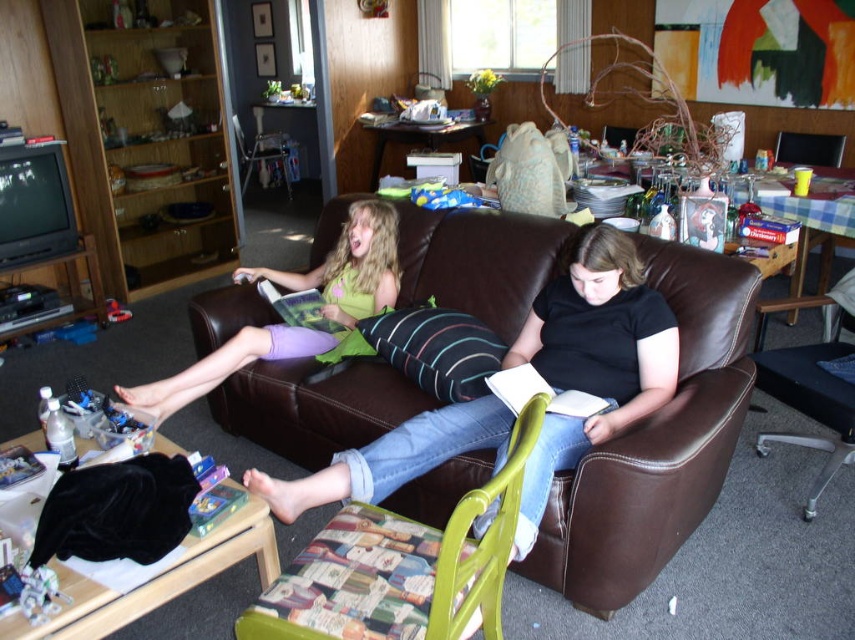
From the picture: You are standing in the living room and want to place a small plant between the two points, point (432, 401) and point (771, 372). Which point should the plant be closer to in order to be closer to the viewer?

The plant should be placed closer to point (432, 401) because it is closer to the viewer than point (771, 372).

You are standing in the living room and want to place a 6 feet long sofa on the wall opposite the brown leather couch at center. Is there enough space?

The brown leather couch at center is 5.98 feet away from the viewer. Since the new sofa is 6 feet long, it may not fit if the available space is only 5.98 feet. Check the exact dimensions of the wall to ensure compatibility.

You are planning to place a large rectangular coffee table in front of the brown leather couch at center and the matte green fabric at center. Which object should the coffee table be placed closer to to ensure it fits better?

The coffee table should be placed closer to the matte green fabric at center because the brown leather couch at center has a lesser width compared to the matte green fabric at center, so the wider matte green fabric area can accommodate a larger table.